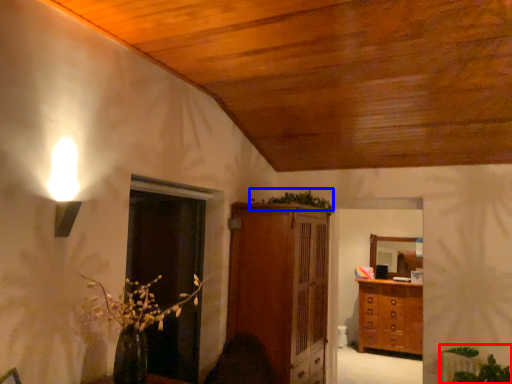
Question: Which point is closer to the camera, plant (highlighted by a red box) or plant (highlighted by a blue box)?

Choices:
 (A) plant
 (B) plant

Answer: (A)